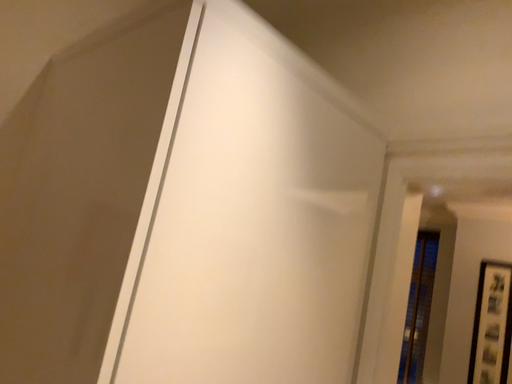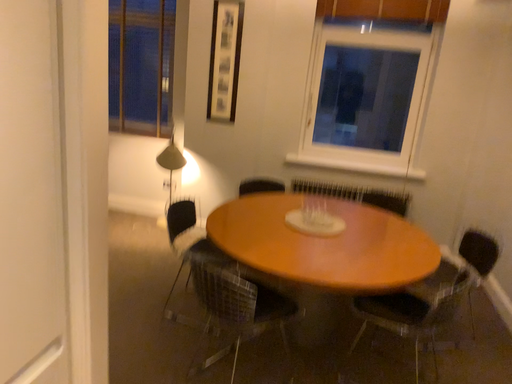
Question: Which way did the camera rotate in the video?

Choices:
 (A) rotated downward
 (B) rotated upward

Answer: (A)